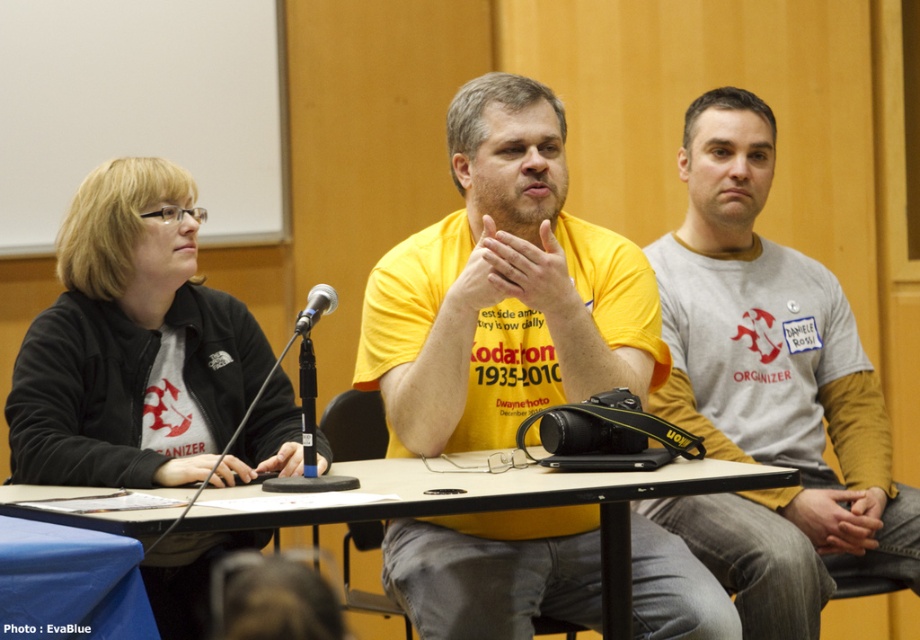
Question: Based on their relative distances, which object is farther from the white plastic table at center?

Choices:
 (A) black metallic microphone at center
 (B) black fabric jacket at left

Answer: (A)

Question: Which point is farther from the camera taking this photo?

Choices:
 (A) pyautogui.click(x=754, y=276)
 (B) pyautogui.click(x=605, y=534)
 (C) pyautogui.click(x=652, y=275)
 (D) pyautogui.click(x=253, y=442)

Answer: (A)

Question: Among these points, which one is farthest from the camera?

Choices:
 (A) (552, 573)
 (B) (118, 312)
 (C) (713, 220)

Answer: (C)

Question: Is yellow matte shirt at center below black metallic microphone at center?

Choices:
 (A) no
 (B) yes

Answer: (B)

Question: Does black fabric jacket at left have a smaller size compared to black metallic microphone at center?

Choices:
 (A) yes
 (B) no

Answer: (B)

Question: Can you confirm if black fabric jacket at left is thinner than white plastic table at center?

Choices:
 (A) yes
 (B) no

Answer: (A)